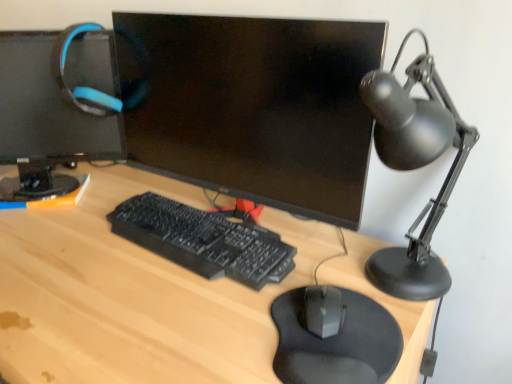
Question: Considering their positions, is black matte desk lamp at right located in front of or behind black plastic keyboard at center?

Choices:
 (A) behind
 (B) front

Answer: (B)

Question: Is black matte desk lamp at right wider or thinner than black plastic keyboard at center?

Choices:
 (A) thin
 (B) wide

Answer: (B)

Question: Which object is the farthest from the black matte desk lamp at right?

Choices:
 (A) black matte mouse at center
 (B) light wood desk at center
 (C) matte black monitor at center, acting as the 2th computer monitor starting from the left
 (D) black matte mousepad at lower center
 (E) black plastic keyboard at center

Answer: (B)

Question: Based on their relative distances, which object is farther from the black matte desk lamp at right?

Choices:
 (A) black matte mouse at center
 (B) black plastic keyboard at center
 (C) matte black monitor at upper left, placed as the 1th computer monitor when sorted from left to right
 (D) light wood desk at center
 (E) matte black monitor at center, acting as the 2th computer monitor starting from the left

Answer: (C)